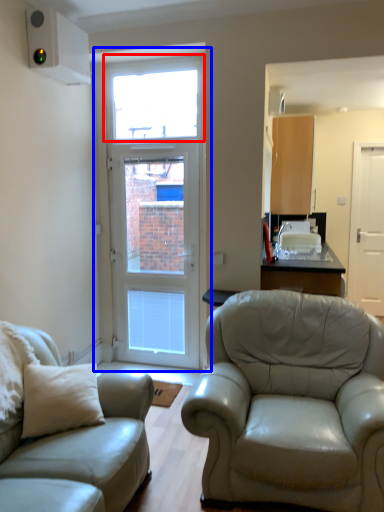
Question: Which object appears farthest to the camera in this image, window (highlighted by a red box) or door (highlighted by a blue box)?

Choices:
 (A) window
 (B) door

Answer: (A)